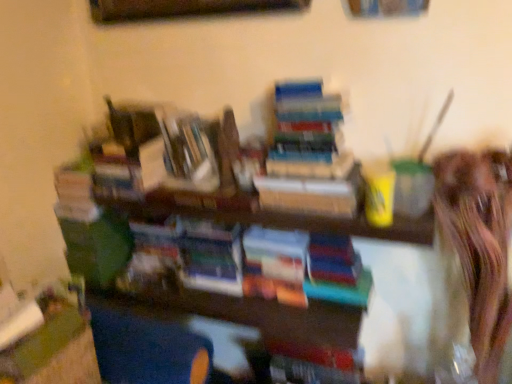
Question: In the image, is hardcover books at center, positioned as the fourth book in left-to-right order, on the left side or the right side of hardcover book at center, the third book viewed from the right?

Choices:
 (A) left
 (B) right

Answer: (B)

Question: From a real-world perspective, is hardcover books at center, the first book when ordered from right to left, positioned above or below hardcover book at center, the third book viewed from the right?

Choices:
 (A) above
 (B) below

Answer: (A)

Question: Which object is the closest to the hardcover books at center, positioned as the fourth book in left-to-right order?

Choices:
 (A) multicolored paper book at center, which is the third book from left to right
 (B) hardcover book at center, the third book viewed from the right
 (C) shiny brown hair at right
 (D) hardcover book at center, arranged as the first book when viewed from the left

Answer: (A)

Question: Considering the real-world distances, which object is closest to the multicolored paper book at center, which is the third book from left to right?

Choices:
 (A) hardcover books at center, positioned as the fourth book in left-to-right order
 (B) hardcover book at center, the third book viewed from the right
 (C) hardcover book at center, acting as the 4th book starting from the right
 (D) shiny brown hair at right

Answer: (B)